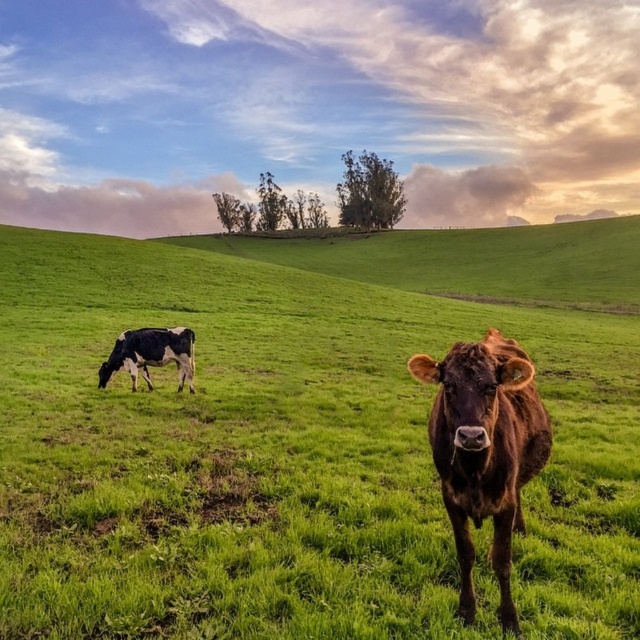
Question: Which of the following is the farthest from the observer?

Choices:
 (A) (420, 524)
 (B) (493, 403)
 (C) (125, 346)

Answer: (C)

Question: Which point is farther to the camera?

Choices:
 (A) brown glossy bull at center
 (B) green grass pasture at center

Answer: (B)

Question: Where is green grass pasture at center located in relation to black and white spotted cow at left in the image?

Choices:
 (A) above
 (B) below

Answer: (A)

Question: Can you confirm if brown glossy bull at center is positioned above black and white spotted cow at left?

Choices:
 (A) no
 (B) yes

Answer: (A)

Question: Is green grass pasture at center to the right of black and white spotted cow at left from the viewer's perspective?

Choices:
 (A) yes
 (B) no

Answer: (A)

Question: Which object is closer to the camera taking this photo?

Choices:
 (A) brown glossy bull at center
 (B) black and white spotted cow at left

Answer: (A)